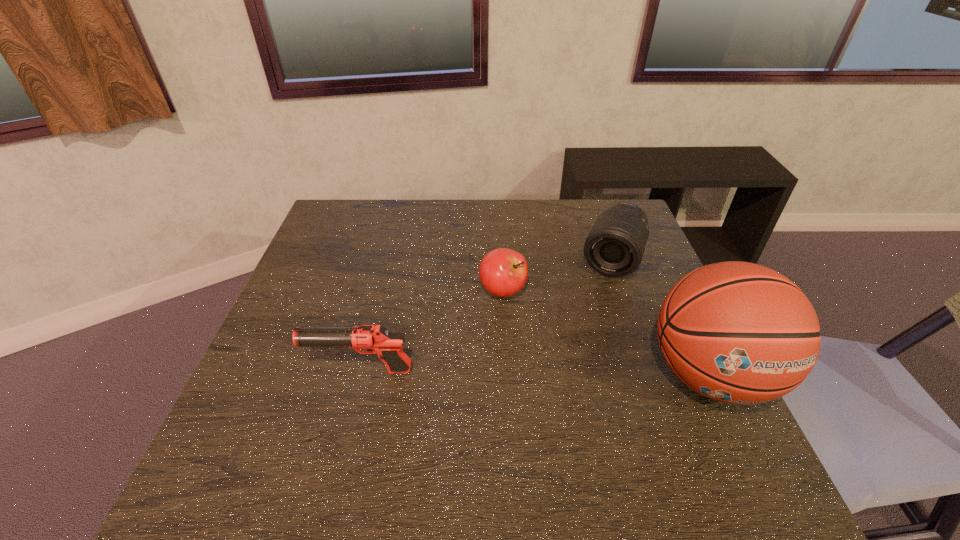
You are a GUI agent. You are given a task and a screenshot of the screen. Output one action in this format:
    pyautogui.click(x=<x>, y=<y>)
    Task: Click on the object that stands as the second closest to the gun
    The height and width of the screenshot is (540, 960).
    Given the screenshot: What is the action you would take?
    pyautogui.click(x=615, y=246)